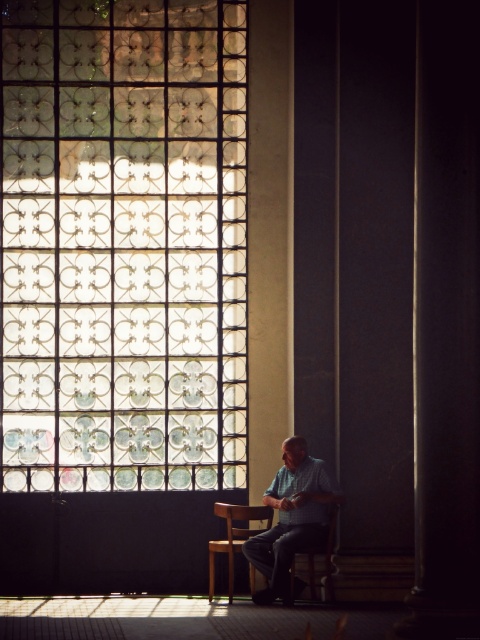
Does clear glass window at upper left have a smaller size compared to wooden chair at center?

No.

Can you confirm if clear glass window at upper left is thinner than wooden chair at center?

No.

Who is more distant from viewer, (15, 381) or (208, 556)?

Positioned behind is point (15, 381).

Identify the location of clear glass window at upper left. This screenshot has height=640, width=480. click(x=123, y=244).

Describe the element at coordinates (291, 516) in the screenshot. I see `checkered fabric shirt at center` at that location.

Is the position of checkered fabric shirt at center more distant than that of wooden chair at lower center?

No, checkered fabric shirt at center is closer to the viewer.

Who is more distant from viewer, (x=282, y=504) or (x=297, y=577)?

Point (x=297, y=577)

Find the location of a particular element. checkered fabric shirt at center is located at coordinates (291, 516).

Can you confirm if clear glass window at upper left is wider than checkered fabric shirt at center?

Correct, the width of clear glass window at upper left exceeds that of checkered fabric shirt at center.

From the picture: Does clear glass window at upper left come in front of checkered fabric shirt at center?

That is False.

Who is more forward, (x=26, y=45) or (x=279, y=488)?

Point (x=279, y=488)

You are a GUI agent. You are given a task and a screenshot of the screen. Output one action in this format:
    pyautogui.click(x=<x>, y=<y>)
    Task: Click on the clear glass window at upper left
    The image size is (480, 640).
    Given the screenshot: What is the action you would take?
    pyautogui.click(x=123, y=244)